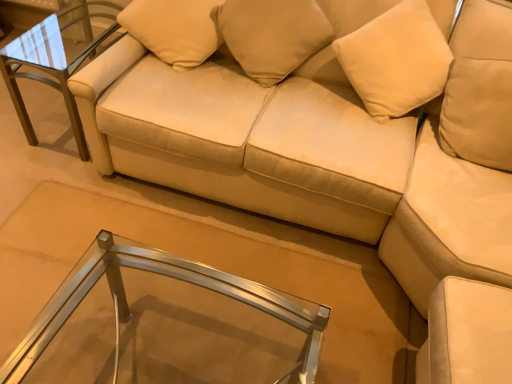
Question: Is beige fabric pillow at upper center, which appears as the first pillow when viewed from the left, not close to clear glass table at center, positioned as the second table in top-to-bottom order?

Choices:
 (A) no
 (B) yes

Answer: (B)

Question: Considering the relative sizes of beige fabric pillow at upper center, which appears as the first pillow when viewed from the left, and clear glass table at center, the 2th table positioned from the left, in the image provided, is beige fabric pillow at upper center, which appears as the first pillow when viewed from the left, taller than clear glass table at center, the 2th table positioned from the left,?

Choices:
 (A) yes
 (B) no

Answer: (B)

Question: Is beige fabric pillow at upper center, which appears as the 2th pillow when viewed from the right, oriented towards clear glass table at center, the first table in the right-to-left sequence?

Choices:
 (A) no
 (B) yes

Answer: (B)

Question: Considering the relative sizes of beige fabric pillow at upper center, which appears as the first pillow when viewed from the left, and clear glass table at center, which is counted as the 2th table, starting from the back, in the image provided, is beige fabric pillow at upper center, which appears as the first pillow when viewed from the left, bigger than clear glass table at center, which is counted as the 2th table, starting from the back,?

Choices:
 (A) no
 (B) yes

Answer: (A)

Question: Is beige fabric pillow at upper center, which appears as the 2th pillow when viewed from the right, positioned with its back to clear glass table at center, positioned as the second table in top-to-bottom order?

Choices:
 (A) no
 (B) yes

Answer: (A)

Question: From the image's perspective, is beige fabric pillow at upper center, which appears as the first pillow when viewed from the left, under clear glass table at center, the first table in the right-to-left sequence?

Choices:
 (A) no
 (B) yes

Answer: (A)

Question: Can you confirm if metal/glass side table at upper left, which ranks as the 2th table in front-to-back order, is positioned to the right of beige fabric pillow at upper center, which appears as the first pillow when viewed from the left?

Choices:
 (A) yes
 (B) no

Answer: (B)

Question: Does metal/glass side table at upper left, which ranks as the 2th table in front-to-back order, turn towards beige fabric pillow at upper center, which appears as the 2th pillow when viewed from the right?

Choices:
 (A) no
 (B) yes

Answer: (A)

Question: Is metal/glass side table at upper left, which ranks as the 2th table in front-to-back order, behind beige fabric pillow at upper center, which appears as the first pillow when viewed from the left?

Choices:
 (A) yes
 (B) no

Answer: (A)

Question: Considering the relative sizes of metal/glass side table at upper left, placed as the 2th table when sorted from right to left, and beige fabric pillow at upper center, which appears as the first pillow when viewed from the left, in the image provided, is metal/glass side table at upper left, placed as the 2th table when sorted from right to left, wider than beige fabric pillow at upper center, which appears as the first pillow when viewed from the left,?

Choices:
 (A) no
 (B) yes

Answer: (B)

Question: From a real-world perspective, is metal/glass side table at upper left, positioned as the first table in back-to-front order, on top of beige fabric pillow at upper center, which appears as the first pillow when viewed from the left?

Choices:
 (A) no
 (B) yes

Answer: (A)

Question: Is metal/glass side table at upper left, the 1th table viewed from the left, bigger than beige fabric pillow at upper center, which appears as the first pillow when viewed from the left?

Choices:
 (A) no
 (B) yes

Answer: (B)

Question: Can we say beige fabric pillow at upper center, the first pillow positioned from the right, lies outside clear glass table at center, the 2th table positioned from the left?

Choices:
 (A) yes
 (B) no

Answer: (A)